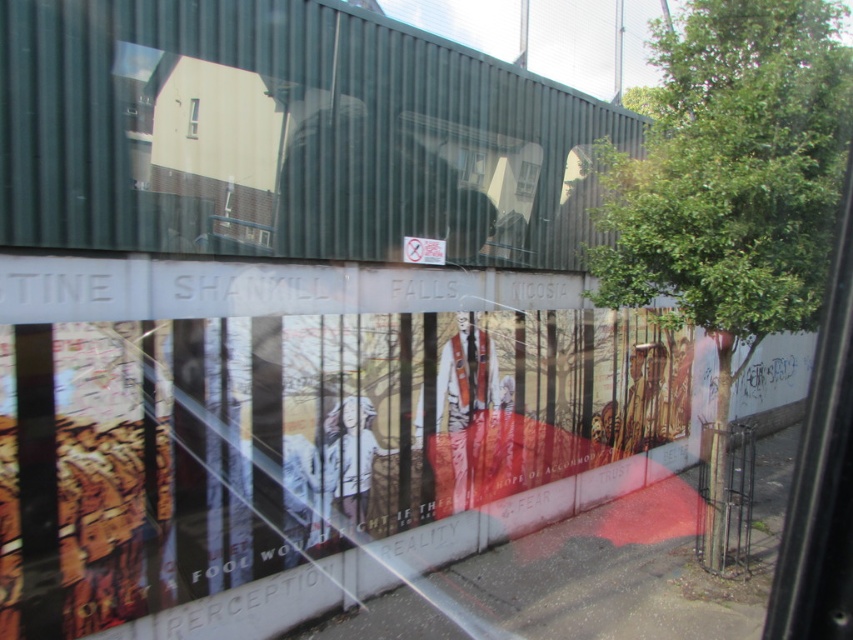
Between point (688, 12) and point (192, 122), which one is positioned behind?

The point (688, 12) is more distant.

Who is positioned more to the left, green leafy tree at center or clear glass window at upper center?

clear glass window at upper center

Describe the element at coordinates (732, 188) in the screenshot. I see `green leafy tree at center` at that location.

I want to click on green leafy tree at center, so click(x=732, y=188).